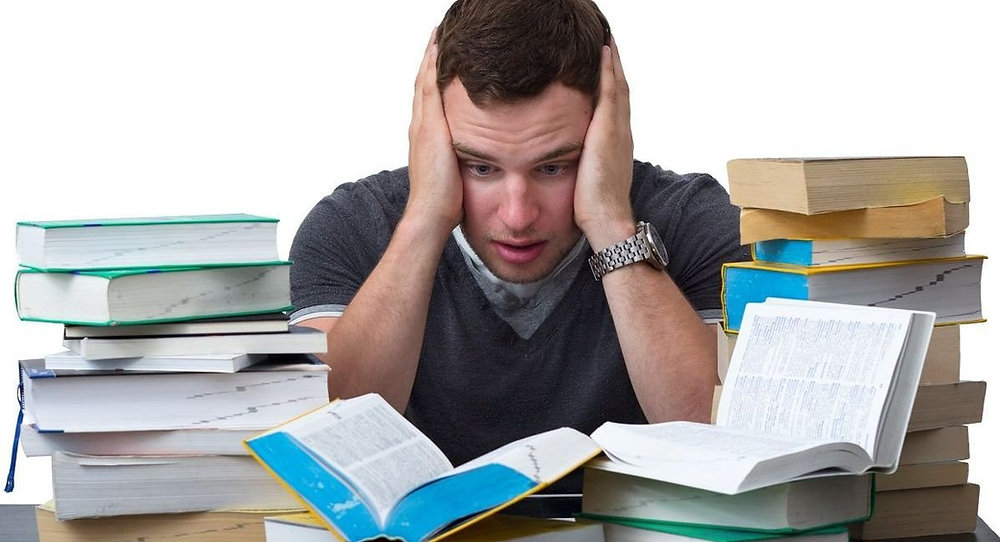
In order to click on books on left side of photo in this screenshot , I will do `click(77, 242)`, `click(101, 301)`, `click(129, 327)`, `click(129, 344)`, `click(174, 360)`, `click(153, 425)`, `click(154, 441)`, `click(154, 487)`, `click(182, 531)`.